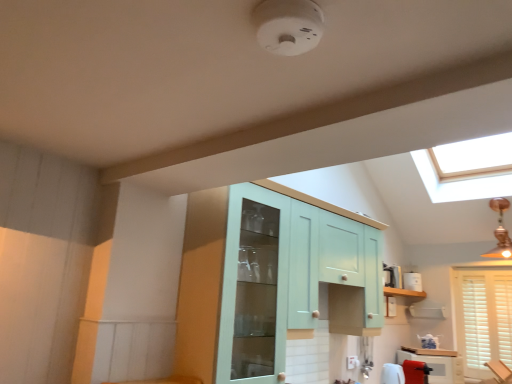
Measure the distance between white plastic toaster at right and camera.

4.07 meters.

Image resolution: width=512 pixels, height=384 pixels. Describe the element at coordinates (437, 366) in the screenshot. I see `matte white cabinet at lower right, the second cabinetry from the top` at that location.

Find the location of a particular element. Image resolution: width=512 pixels, height=384 pixels. white glossy counter top at lower right is located at coordinates (430, 351).

You are a GUI agent. You are given a task and a screenshot of the screen. Output one action in this format:
    pyautogui.click(x=<x>, y=<y>)
    Task: Click on the light teal glass cabinet at center, which appears as the second cabinetry when viewed from the right
    
    Given the screenshot: What is the action you would take?
    pyautogui.click(x=268, y=281)

In order to click on white wooden blinds at lower right in this screenshot , I will do `click(483, 317)`.

Locate an element on the screen. counter top above the matte white cabinet at lower right, which appears as the 2th cabinetry when viewed from the front (from the image's perspective) is located at coordinates (430, 351).

Is white glossy counter top at lower right positioned far away from matte white cabinet at lower right, which is the 2th cabinetry in left-to-right order?

No, white glossy counter top at lower right is not far away from matte white cabinet at lower right, which is the 2th cabinetry in left-to-right order.

Does white glossy counter top at lower right appear on the left side of matte white cabinet at lower right, which appears as the 2th cabinetry when viewed from the front?

Yes.

From the picture: Considering the relative sizes of white glossy counter top at lower right and matte white cabinet at lower right, the first cabinetry when ordered from bottom to top, in the image provided, is white glossy counter top at lower right thinner than matte white cabinet at lower right, the first cabinetry when ordered from bottom to top,?

In fact, white glossy counter top at lower right might be wider than matte white cabinet at lower right, the first cabinetry when ordered from bottom to top.

Is matte white cabinet at lower right, the second cabinetry from the top, positioned in front of white plastic toaster at right?

Yes.

Is matte white cabinet at lower right, the first cabinetry when ordered from bottom to top, facing towards white plastic toaster at right?

No.

From a real-world perspective, is matte white cabinet at lower right, which is the 2th cabinetry in left-to-right order, on white plastic toaster at right?

Incorrect, from a real-world perspective, matte white cabinet at lower right, which is the 2th cabinetry in left-to-right order, is lower than white plastic toaster at right.

What's the angular difference between light teal glass cabinet at center, the first cabinetry from the top, and white glossy counter top at lower right's facing directions?

The facing directions of light teal glass cabinet at center, the first cabinetry from the top, and white glossy counter top at lower right are 43.2 degrees apart.

Which is less distant, (239,276) or (439,354)?

Point (239,276) is closer to the camera than point (439,354).

Identify the location of counter top lying below the light teal glass cabinet at center, arranged as the second cabinetry when ordered from the bottom (from the image's perspective). The image size is (512, 384). (x=430, y=351).

From a real-world perspective, is light teal glass cabinet at center, the first cabinetry from the top, above or below white glossy counter top at lower right?

From a real-world perspective, light teal glass cabinet at center, the first cabinetry from the top, is physically above white glossy counter top at lower right.

Which object is thinner, white glossy counter top at lower right or light teal glass cabinet at center, the first cabinetry from the top?

With smaller width is white glossy counter top at lower right.

Is white glossy counter top at lower right inside the boundaries of light teal glass cabinet at center, arranged as the second cabinetry when ordered from the bottom, or outside?

white glossy counter top at lower right lies outside light teal glass cabinet at center, arranged as the second cabinetry when ordered from the bottom.

In the image, is white glossy counter top at lower right positioned in front of or behind light teal glass cabinet at center, arranged as the second cabinetry when ordered from the bottom?

white glossy counter top at lower right is behind light teal glass cabinet at center, arranged as the second cabinetry when ordered from the bottom.

Could you measure the distance between white wooden blinds at lower right and matte white cabinet at lower right, which appears as the 2th cabinetry when viewed from the front?

white wooden blinds at lower right and matte white cabinet at lower right, which appears as the 2th cabinetry when viewed from the front, are 17.38 inches apart from each other.

What's the angular difference between white wooden blinds at lower right and matte white cabinet at lower right, the 1th cabinetry viewed from the back,'s facing directions?

44.6 degrees.

Are white wooden blinds at lower right and matte white cabinet at lower right, the 1th cabinetry viewed from the back, making contact?

white wooden blinds at lower right and matte white cabinet at lower right, the 1th cabinetry viewed from the back, are clearly separated.

Considering their positions, is white wooden blinds at lower right located in front of or behind matte white cabinet at lower right, which appears as the 2th cabinetry when viewed from the front?

white wooden blinds at lower right is positioned farther from the viewer than matte white cabinet at lower right, which appears as the 2th cabinetry when viewed from the front.

Is white wooden blinds at lower right at the right side of white glossy counter top at lower right?

Indeed, white wooden blinds at lower right is positioned on the right side of white glossy counter top at lower right.

What's the angular difference between white wooden blinds at lower right and white glossy counter top at lower right's facing directions?

There is a 46.5-degree angle between the facing directions of white wooden blinds at lower right and white glossy counter top at lower right.

Looking at this image, does white wooden blinds at lower right have a greater height compared to white glossy counter top at lower right?

Yes.

Would you say light teal glass cabinet at center, which appears as the second cabinetry when viewed from the right, is to the left or to the right of matte white cabinet at lower right, which appears as the 2th cabinetry when viewed from the front, in the picture?

light teal glass cabinet at center, which appears as the second cabinetry when viewed from the right, is to the left of matte white cabinet at lower right, which appears as the 2th cabinetry when viewed from the front.

Is light teal glass cabinet at center, arranged as the second cabinetry when ordered from the bottom, oriented towards matte white cabinet at lower right, the first cabinetry when ordered from bottom to top?

No, light teal glass cabinet at center, arranged as the second cabinetry when ordered from the bottom, is not turned towards matte white cabinet at lower right, the first cabinetry when ordered from bottom to top.

From the image's perspective, relative to matte white cabinet at lower right, the 1th cabinetry viewed from the back, is light teal glass cabinet at center, marked as the first cabinetry in a front-to-back arrangement, above or below?

From the image's perspective, light teal glass cabinet at center, marked as the first cabinetry in a front-to-back arrangement, appears above matte white cabinet at lower right, the 1th cabinetry viewed from the back.

Does light teal glass cabinet at center, marked as the second cabinetry in a back-to-front arrangement, touch matte white cabinet at lower right, which appears as the 2th cabinetry when viewed from the front?

No, light teal glass cabinet at center, marked as the second cabinetry in a back-to-front arrangement, is not with matte white cabinet at lower right, which appears as the 2th cabinetry when viewed from the front.

Locate an element on the screen. This screenshot has height=384, width=512. counter top that appears on the left of matte white cabinet at lower right, the 1th cabinetry viewed from the back is located at coordinates (430, 351).

Find the location of a particular element. cabinetry that is on the right side of white plastic toaster at right is located at coordinates (437, 366).

From the image, which object appears to be nearer to white wooden blinds at lower right, white plastic toaster at right or light teal glass cabinet at center, marked as the second cabinetry in a back-to-front arrangement?

Among the two, white plastic toaster at right is located nearer to white wooden blinds at lower right.

When comparing their distances from light teal glass cabinet at center, which appears as the second cabinetry when viewed from the right, does white wooden blinds at lower right or matte white cabinet at lower right, the first cabinetry when ordered from bottom to top, seem further?

white wooden blinds at lower right lies further to light teal glass cabinet at center, which appears as the second cabinetry when viewed from the right, than the other object.

From the image, which object appears to be farther from white glossy counter top at lower right, white plastic toaster at right or light teal glass cabinet at center, which appears as the second cabinetry when viewed from the right?

light teal glass cabinet at center, which appears as the second cabinetry when viewed from the right, is positioned further to the anchor white glossy counter top at lower right.

Looking at the image, which one is located further to white wooden blinds at lower right, white plastic toaster at right or white glossy counter top at lower right?

Among the two, white plastic toaster at right is located further to white wooden blinds at lower right.

Consider the image. Which object lies further to the anchor point white glossy counter top at lower right, white wooden blinds at lower right or white plastic toaster at right?

white plastic toaster at right.

Looking at the image, which one is located closer to light teal glass cabinet at center, marked as the second cabinetry in a back-to-front arrangement, white wooden blinds at lower right or white glossy counter top at lower right?

white wooden blinds at lower right is closer to light teal glass cabinet at center, marked as the second cabinetry in a back-to-front arrangement.

From the image, which object appears to be farther from matte white cabinet at lower right, which is the 2th cabinetry in left-to-right order, white wooden blinds at lower right or white glossy counter top at lower right?

white wooden blinds at lower right is positioned further to the anchor matte white cabinet at lower right, which is the 2th cabinetry in left-to-right order.

Based on the photo, from the image, which object appears to be nearer to white plastic toaster at right, light teal glass cabinet at center, the first cabinetry from the top, or white glossy counter top at lower right?

The object closer to white plastic toaster at right is white glossy counter top at lower right.

You are a GUI agent. You are given a task and a screenshot of the screen. Output one action in this format:
    pyautogui.click(x=<x>, y=<y>)
    Task: Click on the counter top situated between light teal glass cabinet at center, the first cabinetry from the top, and white wooden blinds at lower right from left to right
    
    Given the screenshot: What is the action you would take?
    pyautogui.click(x=430, y=351)

At what (x,y) coordinates should I click in order to perform the action: click on cabinetry positioned between light teal glass cabinet at center, which is the first cabinetry from left to right, and white glossy counter top at lower right from near to far. Please return your answer as a coordinate pair (x, y). The image size is (512, 384). Looking at the image, I should click on (437, 366).

Identify the location of appliance between white glossy counter top at lower right and white wooden blinds at lower right from left to right. The image size is (512, 384). (412, 281).

Identify the location of counter top between white plastic toaster at right and matte white cabinet at lower right, the second cabinetry from the top, in the vertical direction. (430, 351).